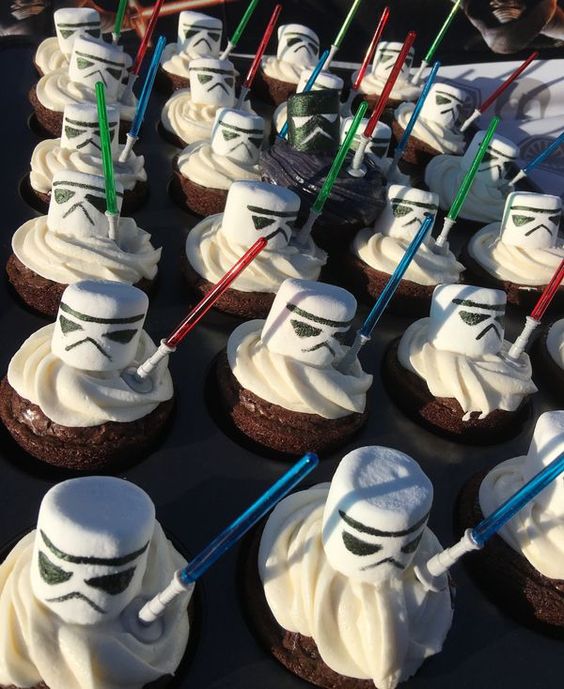
At what (x,y) coordinates should I click in order to perform the action: click on table. Please return your answer as a coordinate pair (x, y). This screenshot has height=689, width=564. Looking at the image, I should click on (190, 497).